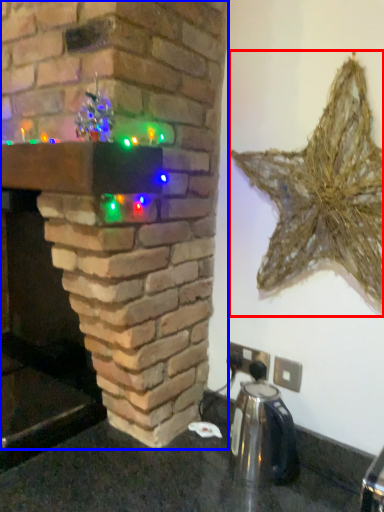
Question: Which of the following is the closest to the observer, star (highlighted by a red box) or fireplace (highlighted by a blue box)?

Choices:
 (A) star
 (B) fireplace

Answer: (B)